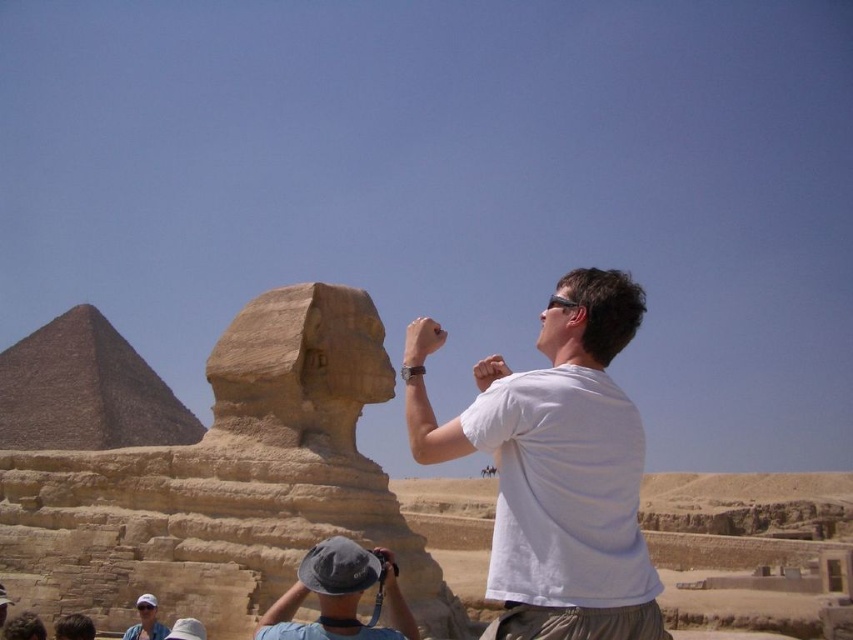
You are standing at the point marked as point [85,390] in the image. What object is located exactly at that point?

The beige stone pyramid at left is located exactly at point [85,390].